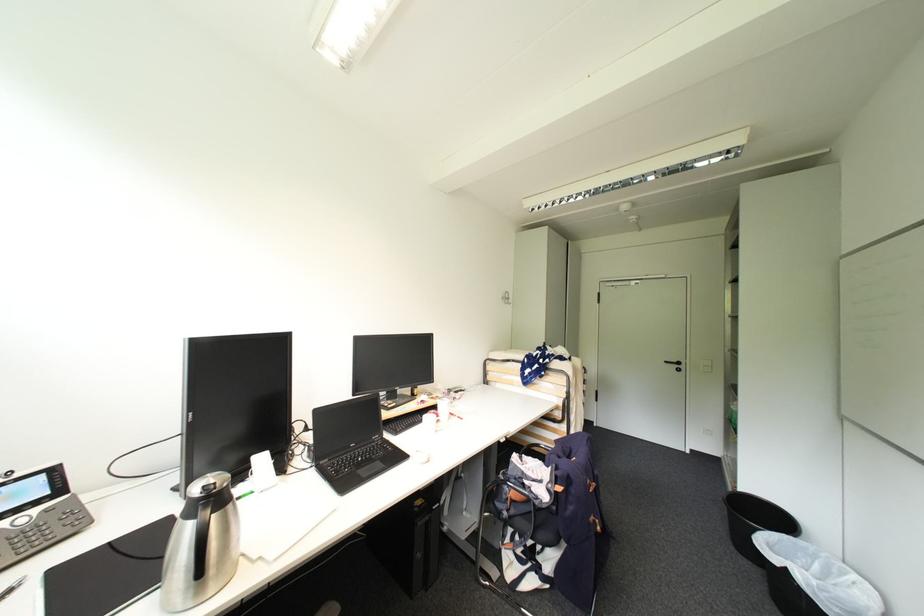
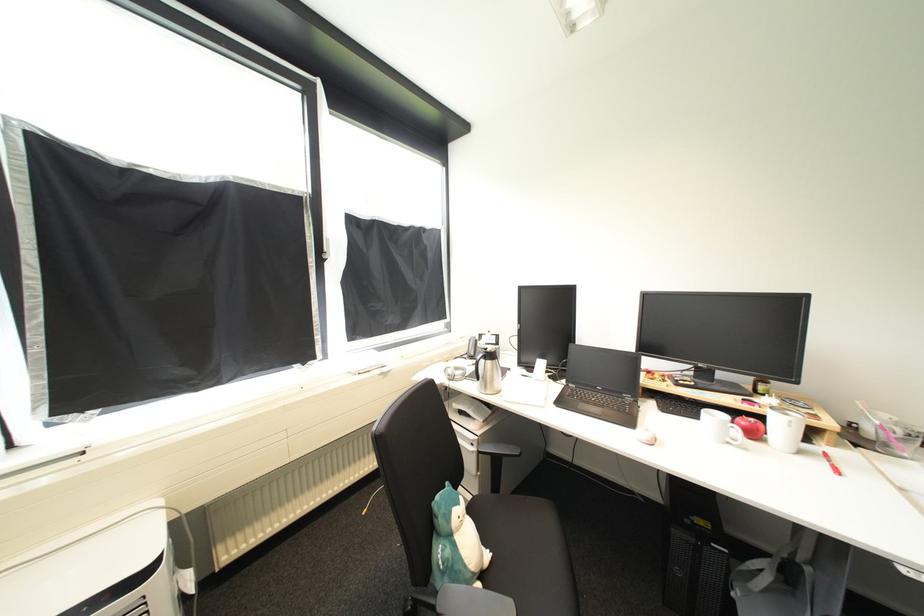
Locate, in the second image, the point that corresponds to the point at 444,432 in the first image.

(736, 445)